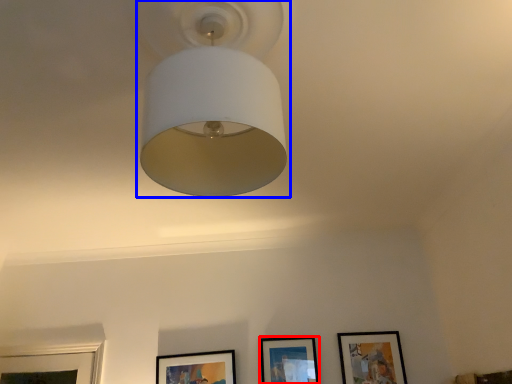
Question: Which object is closer to the camera taking this photo, picture frame (highlighted by a red box) or lamp (highlighted by a blue box)?

Choices:
 (A) picture frame
 (B) lamp

Answer: (B)